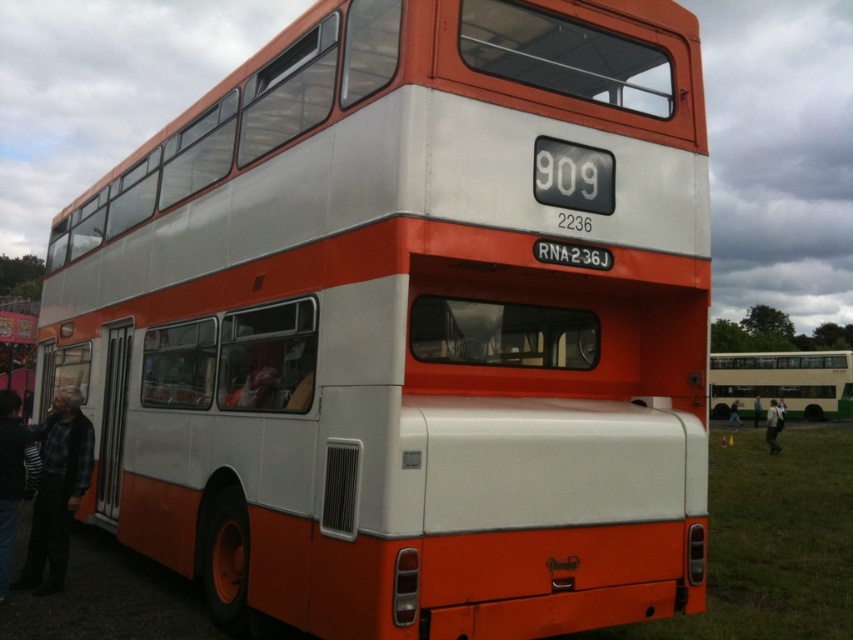
From the picture: You are a photographer standing at the back of the double decker bus and want to take a picture of the people near the open rear doors. In the scene, there are two people wearing a white fabric shirt at lower right and a dark gray fabric jacket at lower right. Which clothing item is positioned more to the left side of the photo?

The white fabric shirt at lower right is positioned to the left of the dark gray fabric jacket at lower right, so it will appear more to the left side of the photo.

You are standing in front of the double decker bus and want to determine the relative positions of two points marked on the bus. Which point is closer to you, the point at coordinate (775, 449) or the point at coordinate (737, 401)?

The point at coordinate (775, 449) is closer to the viewer than the point at coordinate (737, 401).

You are standing in front of the double decker bus and see the point marked at coordinates [773,426]. What object is located at that point?

The point at coordinates [773,426] marks the white fabric shirt at lower right.